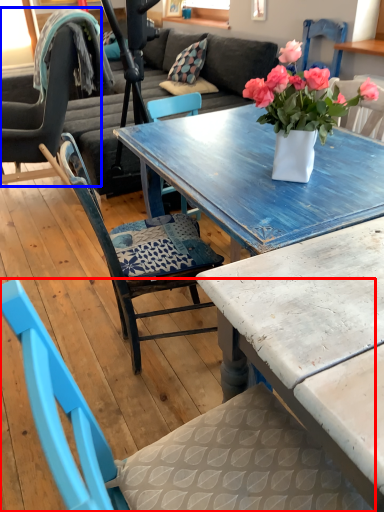
Question: Which of the following is the closest to the observer, chair (highlighted by a red box) or chair (highlighted by a blue box)?

Choices:
 (A) chair
 (B) chair

Answer: (A)